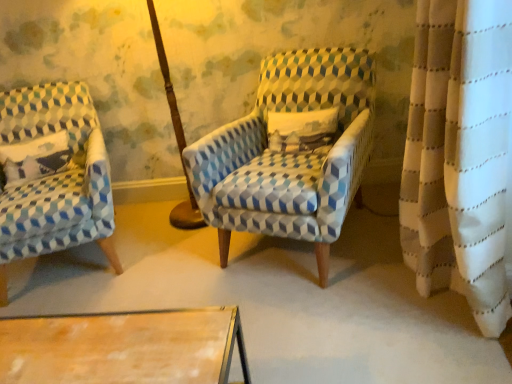
Question: Is white cotton pillow at left in front of or behind blue and white patterned armchair at center, the second chair from the left, in the image?

Choices:
 (A) front
 (B) behind

Answer: (B)

Question: From their relative heights in the image, would you say white cotton pillow at left is taller or shorter than blue and white patterned armchair at center, the second chair from the left?

Choices:
 (A) short
 (B) tall

Answer: (A)

Question: Estimate the real-world distances between objects in this image. Which object is closer to the blue and white geometric-patterned armchair at left, arranged as the first chair when viewed from the left?

Choices:
 (A) white cotton pillow at left
 (B) blue and white patterned armchair at center, the first chair from the right

Answer: (A)

Question: Which of these objects is positioned farthest from the white cotton pillow at left?

Choices:
 (A) blue and white geometric-patterned armchair at left, arranged as the first chair when viewed from the left
 (B) blue and white patterned armchair at center, the first chair from the right

Answer: (B)